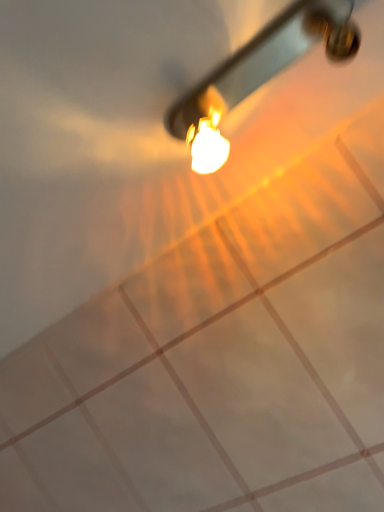
The height and width of the screenshot is (512, 384). What do you see at coordinates (258, 73) in the screenshot?
I see `matte glass bulb at upper center` at bounding box center [258, 73].

Locate an element on the screen. matte glass bulb at upper center is located at coordinates (258, 73).

Identify the location of matte glass bulb at upper center. This screenshot has height=512, width=384. (258, 73).